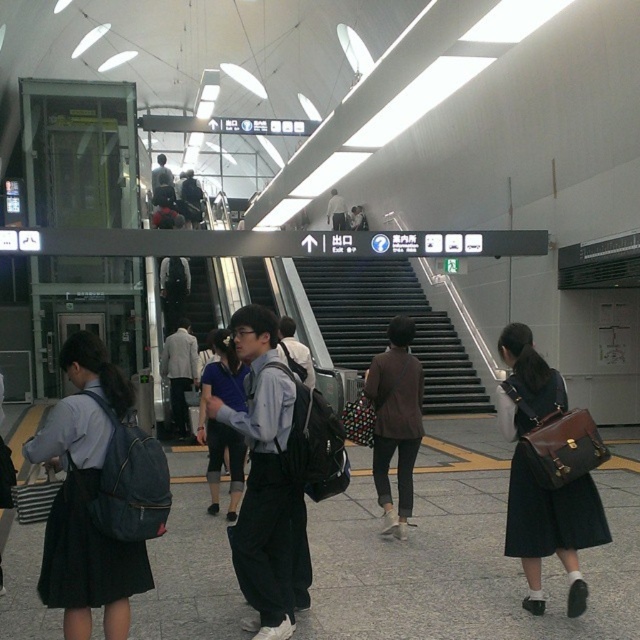
Question: Which point is farther to the camera?

Choices:
 (A) matte blue backpack at center
 (B) black metal stairs at center

Answer: (B)

Question: From the image, what is the correct spatial relationship of matte brown leather bag at lower right in relation to matte blue backpack at center?

Choices:
 (A) right
 (B) left

Answer: (A)

Question: Is matte brown leather bag at lower right to the right of black metal stairs at center from the viewer's perspective?

Choices:
 (A) yes
 (B) no

Answer: (A)

Question: Is the position of matte brown leather bag at lower right more distant than that of black metal stairs at center?

Choices:
 (A) yes
 (B) no

Answer: (B)

Question: Which point is farther from the camera taking this photo?

Choices:
 (A) (124, 381)
 (B) (378, 282)
 (C) (508, 397)
 (D) (221, 328)

Answer: (B)

Question: Estimate the real-world distances between objects in this image. Which object is closer to the black metal stairs at center?

Choices:
 (A) matte blue backpack at center
 (B) matte brown leather bag at lower right

Answer: (A)